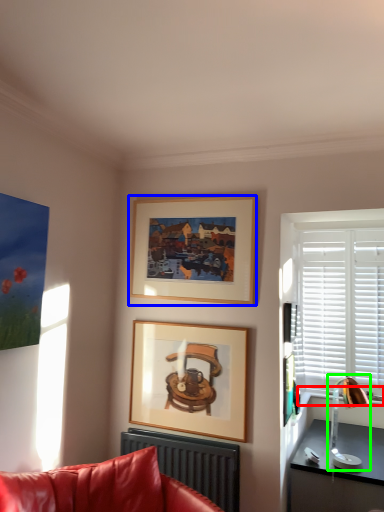
Question: Considering the real-world distances, which object is farthest from window sill (highlighted by a red box)? picture frame (highlighted by a blue box) or table lamp (highlighted by a green box)?

Choices:
 (A) picture frame
 (B) table lamp

Answer: (A)